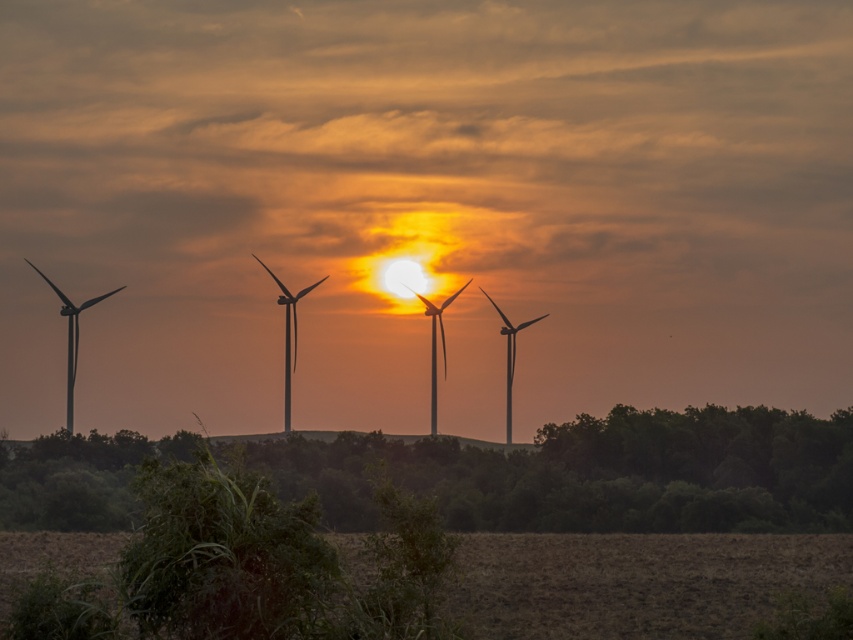
Between metallic wind turbines at center and silvery metallic wind turbine at center, which one appears on the left side from the viewer's perspective?

Positioned to the left is metallic wind turbines at center.

Where is `metallic wind turbines at center`? metallic wind turbines at center is located at coordinates (236, 362).

Find the location of `metallic wind turbines at center`. metallic wind turbines at center is located at coordinates (236, 362).

Can you confirm if silvery metallic wind turbine at center is taller than metallic gray wind turbine at center?

Incorrect, silvery metallic wind turbine at center's height is not larger of metallic gray wind turbine at center's.

Could you measure the distance between silvery metallic wind turbine at center and metallic gray wind turbine at center?

They are 5.03 meters apart.

Is point (460, 291) positioned in front of point (512, 326)?

No, (460, 291) is behind (512, 326).

What are the coordinates of `silvery metallic wind turbine at center` in the screenshot? It's located at (434, 348).

Consider the image. Does metallic wind turbines at center lie in front of metallic gray windmill at center?

Yes, it is in front of metallic gray windmill at center.

Is metallic wind turbines at center taller than metallic gray windmill at center?

Yes.

The image size is (853, 640). I want to click on metallic wind turbines at center, so click(236, 362).

You are a GUI agent. You are given a task and a screenshot of the screen. Output one action in this format:
    pyautogui.click(x=<x>, y=<y>)
    Task: Click on the metallic wind turbines at center
    This screenshot has height=640, width=853.
    Given the screenshot: What is the action you would take?
    pyautogui.click(x=236, y=362)